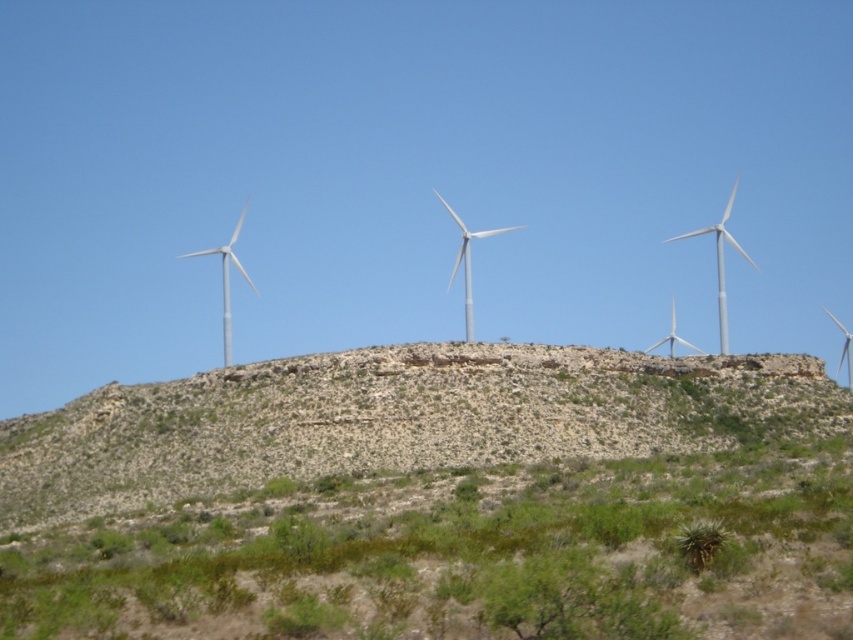
Question: Among these points, which one is nearest to the camera?

Choices:
 (A) (479, 236)
 (B) (247, 458)
 (C) (838, 372)
 (D) (200, 256)

Answer: (B)

Question: Estimate the real-world distances between objects in this image. Which object is closer to the white matte wind turbine at left?

Choices:
 (A) white metallic wind turbine at right
 (B) green shrubbery at lower center

Answer: (A)

Question: Considering the relative positions of green shrubbery at lower center and white matte wind turbine at left in the image provided, where is green shrubbery at lower center located with respect to white matte wind turbine at left?

Choices:
 (A) right
 (B) left

Answer: (A)

Question: Does white metallic wind turbine at center have a smaller size compared to white metallic wind turbine at right?

Choices:
 (A) no
 (B) yes

Answer: (B)

Question: Does green shrubbery at lower center appear on the left side of white metallic wind turbine at upper right?

Choices:
 (A) no
 (B) yes

Answer: (B)

Question: Considering the real-world distances, which object is closest to the green shrubbery at lower center?

Choices:
 (A) white metallic wind turbine at right
 (B) white metallic wind turbine at center
 (C) white matte wind turbine at center

Answer: (B)